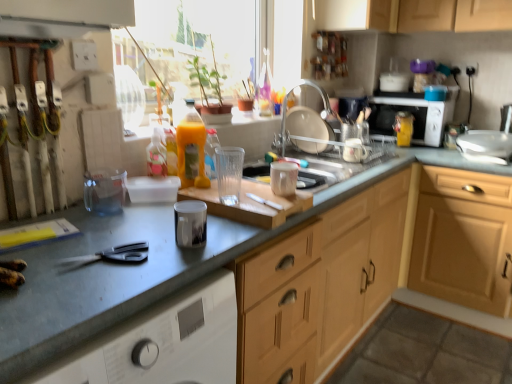
Question: Is white plastic knife at center situated inside matte silver tap at upper center or outside?

Choices:
 (A) outside
 (B) inside

Answer: (A)

Question: Is point (260, 200) positioned closer to the camera than point (291, 132)?

Choices:
 (A) closer
 (B) farther

Answer: (A)

Question: Estimate the real-world distances between objects in this image. Which object is farther from the black plastic scissors at lower left?

Choices:
 (A) metallic silver sink at upper right, the 4th appliance positioned from the bottom
 (B) matte white cup at center, marked as the third appliance in a front-to-back arrangement
 (C) transparent glass window at upper center
 (D) metallic gray countertop at center-left, which appears as the 1th countertop when viewed from the left
 (E) yellow matte bottle at upper right, arranged as the 3th bottle when viewed from the front

Answer: (A)

Question: Which is nearer to the matte silver tap at upper center?

Choices:
 (A) translucent plastic bottle at center, placed as the 3th bottle when sorted from back to front
 (B) metallic gray cutting board at center, which ranks as the second countertop in left-to-right order
 (C) metallic gray countertop at center-left, which ranks as the 2th countertop in right-to-left order
 (D) white glossy microwave at upper right
 (E) white ceramic mug at upper center, which ranks as the 4th appliance in left-to-right order

Answer: (E)